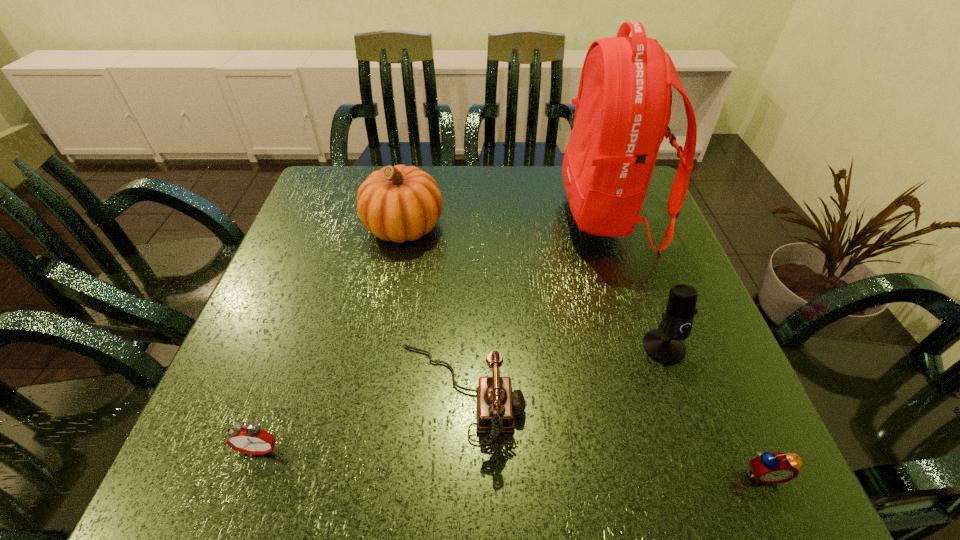
You are a GUI agent. You are given a task and a screenshot of the screen. Output one action in this format:
    pyautogui.click(x=<x>, y=<y>)
    Task: Click on the backpack
    
    Given the screenshot: What is the action you would take?
    pyautogui.click(x=623, y=108)

Find the location of a particular element. pumpkin is located at coordinates (397, 203).

Locate an element on the screen. the third tallest object is located at coordinates (665, 345).

Where is `telephone`? The width and height of the screenshot is (960, 540). telephone is located at coordinates (496, 403).

You are a GUI agent. You are given a task and a screenshot of the screen. Output one action in this format:
    pyautogui.click(x=<x>, y=<y>)
    Task: Click on the farther alarm clock
    Image resolution: width=960 pixels, height=540 pixels.
    Given the screenshot: What is the action you would take?
    pyautogui.click(x=252, y=440)

Locate an element on the screen. the left alarm clock is located at coordinates (252, 440).

At what (x,y) coordinates should I click in order to perform the action: click on the nearer alarm clock. Please return your answer as a coordinate pair (x, y). Looking at the image, I should click on (769, 468).

The width and height of the screenshot is (960, 540). What are the coordinates of `free space located on the main compartment of the tallest object` in the screenshot? It's located at (x=476, y=216).

Where is `free space located 0.090m on the main compartment of the tallest object`? free space located 0.090m on the main compartment of the tallest object is located at coordinates (527, 216).

The image size is (960, 540). What are the coordinates of `free space located 0.080m on the main compartment of the tallest object` in the screenshot? It's located at (531, 216).